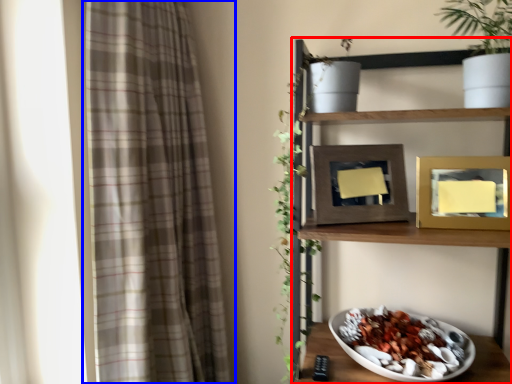
Question: Which object is further to the camera taking this photo, shelf (highlighted by a red box) or curtain (highlighted by a blue box)?

Choices:
 (A) shelf
 (B) curtain

Answer: (B)